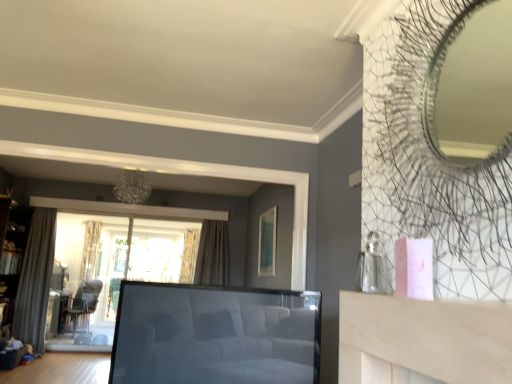
Question: Is point (5, 210) positioned closer to the camera than point (79, 296)?

Choices:
 (A) closer
 (B) farther

Answer: (A)

Question: From a real-world perspective, is wooden bookshelf at left physically located above or below dark brown leather armchair at lower left?

Choices:
 (A) below
 (B) above

Answer: (B)

Question: Which of these objects is positioned closest to the dark brown leather armchair at lower left?

Choices:
 (A) patterned fabric curtain at center, which ranks as the 1th curtain in back-to-front order
 (B) wooden bookshelf at left
 (C) white leather studio couch at center
 (D) matte green picture frame at upper center
 (E) transparent glass window at center

Answer: (E)

Question: Estimate the real-world distances between objects in this image. Which object is farther from the matte green picture frame at upper center?

Choices:
 (A) wooden bookshelf at left
 (B) white leather studio couch at center
 (C) gray fabric curtain at left, the second curtain positioned from the left
 (D) beige fabric curtain at center, marked as the first curtain in a right-to-left arrangement
 (E) silky gray curtain at left, the 1th curtain positioned from the left

Answer: (A)